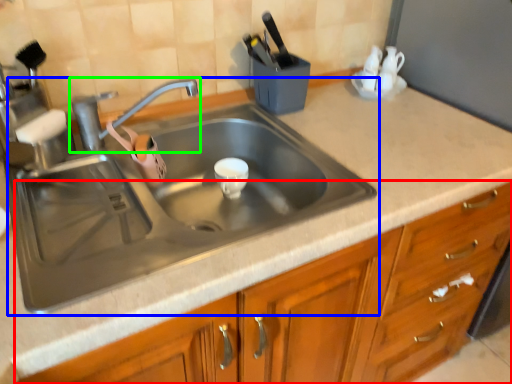
Question: Based on their relative distances, which object is nearer to cabinetry (highlighted by a red box)? Choose from sink (highlighted by a blue box) and tap (highlighted by a green box).

Choices:
 (A) sink
 (B) tap

Answer: (A)